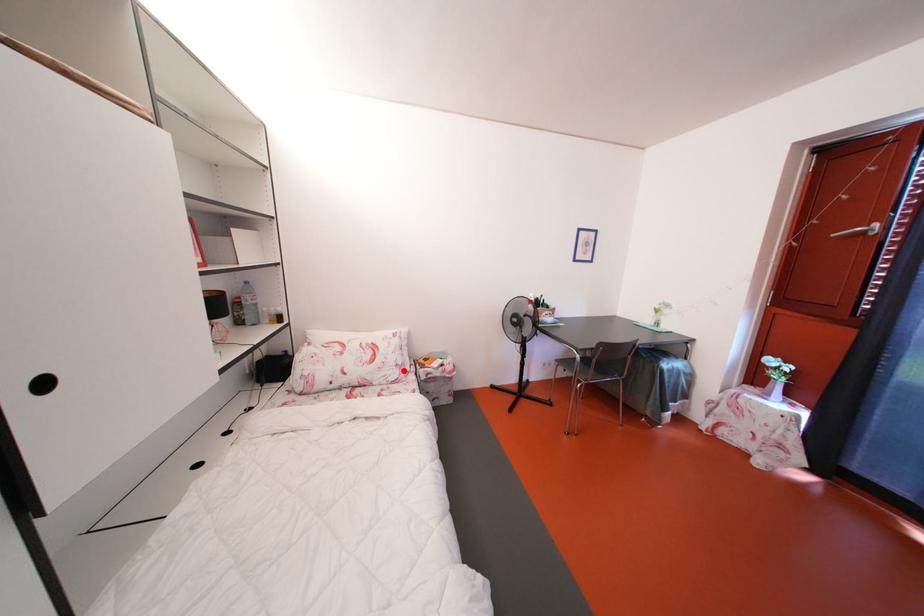
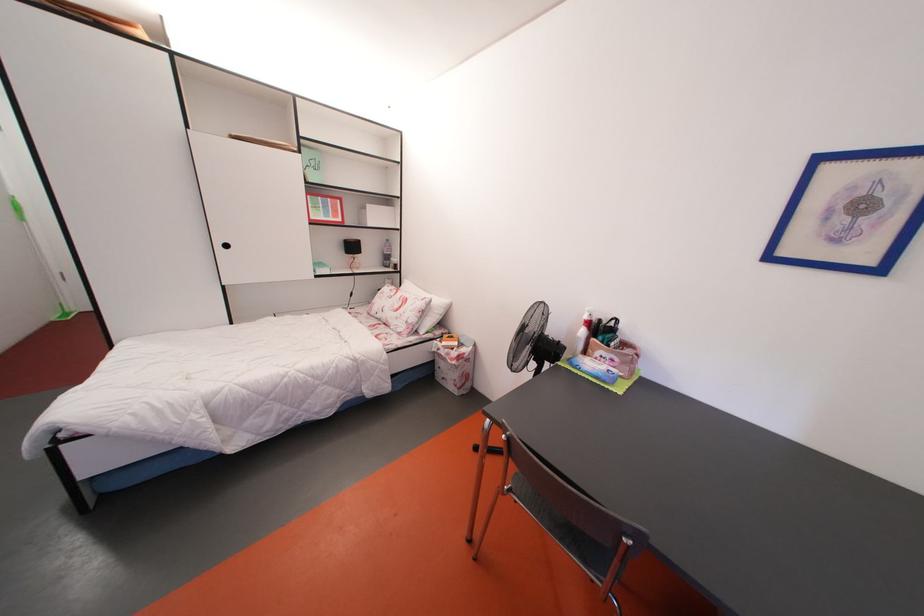
Question: A red point is marked in image1. In image2, is the corresponding 3D point closer to the camera or farther? Reply with the corresponding letter.

Choices:
 (A) The corresponding 3D point is closer.
 (B) The corresponding 3D point is farther.

Answer: (B)